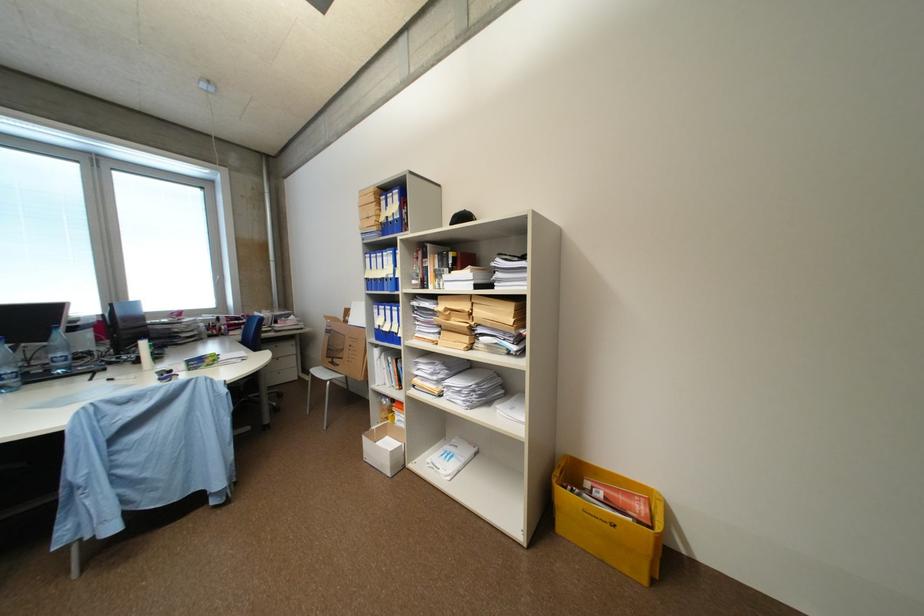
The image size is (924, 616). I want to click on white window handle, so click(217, 280).